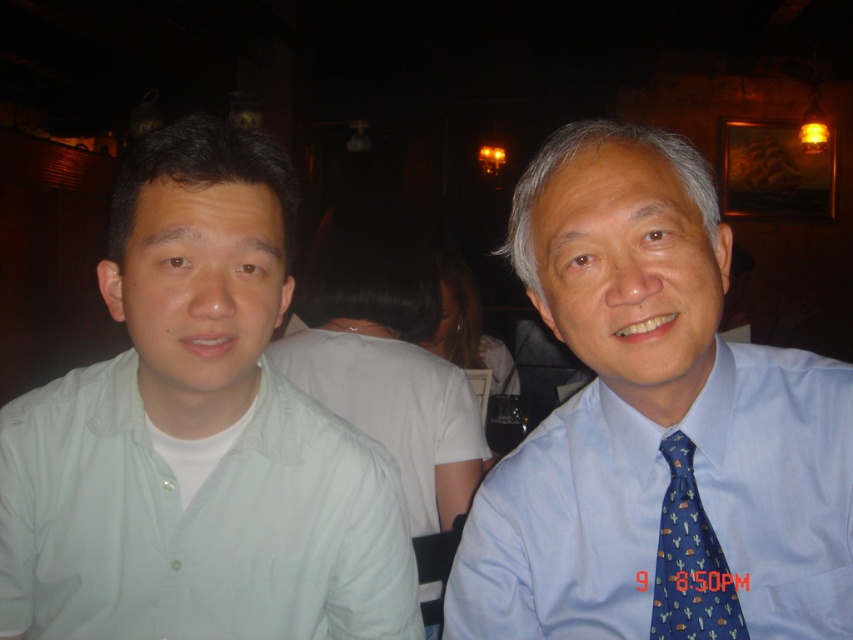
Does light green cotton shirt at left appear on the left side of blue silk tie at right?

Yes, light green cotton shirt at left is to the left of blue silk tie at right.

Is point (143, 264) farther from camera compared to point (664, 454)?

No, it is in front of (664, 454).

Is point (251, 138) positioned behind point (695, 532)?

That is True.

You are a GUI agent. You are given a task and a screenshot of the screen. Output one action in this format:
    pyautogui.click(x=<x>, y=<y>)
    Task: Click on the light green cotton shirt at left
    The width and height of the screenshot is (853, 640).
    Given the screenshot: What is the action you would take?
    pyautogui.click(x=196, y=435)

Consider the image. Does blue silk shirt at right appear under blue silk tie at right?

Actually, blue silk shirt at right is above blue silk tie at right.

Measure the distance between point (848, 433) and camera.

The distance of point (848, 433) from camera is 25.07 inches.

Locate an element on the screen. The image size is (853, 640). blue silk shirt at right is located at coordinates (654, 424).

The width and height of the screenshot is (853, 640). What are the coordinates of `blue silk shirt at right` in the screenshot? It's located at (654, 424).

Is light green cotton shirt at left positioned behind blue silk shirt at right?

Yes, light green cotton shirt at left is further from the viewer.

Consider the image. Can you confirm if light green cotton shirt at left is shorter than blue silk shirt at right?

No.

Between point (254, 237) and point (479, 625), which one is positioned in front?

Point (254, 237)

Locate an element on the screen. Image resolution: width=853 pixels, height=640 pixels. light green cotton shirt at left is located at coordinates (196, 435).